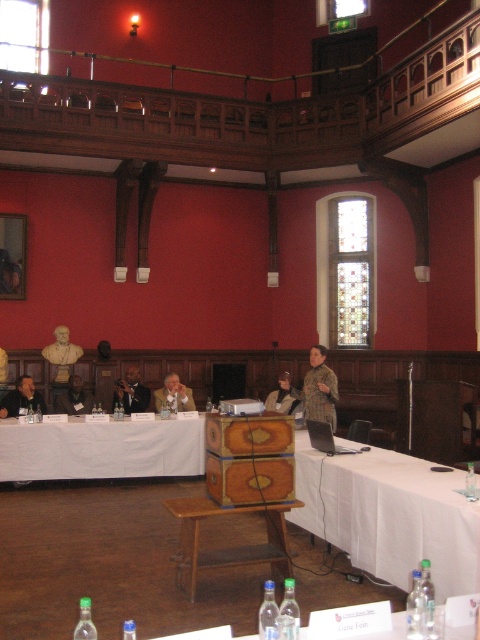
Is light brown wooden chair at center to the right of golden bust at left from the viewer's perspective?

Correct, you'll find light brown wooden chair at center to the right of golden bust at left.

Which is in front, point (157, 397) or point (54, 346)?

Point (157, 397)

Locate an element on the screen. The image size is (480, 640). light brown wooden chair at center is located at coordinates (173, 396).

Is white cloth-covered table at center behind dark brown leather jacket at center?

No, it is not.

Does white cloth-covered table at center have a smaller size compared to dark brown leather jacket at center?

Actually, white cloth-covered table at center might be larger than dark brown leather jacket at center.

Where is `white cloth-covered table at center`? The image size is (480, 640). white cloth-covered table at center is located at coordinates (389, 515).

Who is higher up, white cloth at lower left or patterned fabric shirt at center?

Positioned higher is patterned fabric shirt at center.

This screenshot has width=480, height=640. I want to click on white cloth at lower left, so click(100, 449).

The image size is (480, 640). What are the coordinates of `white cloth at lower left` in the screenshot? It's located at (100, 449).

Where is `white cloth at lower left`? Image resolution: width=480 pixels, height=640 pixels. white cloth at lower left is located at coordinates (100, 449).